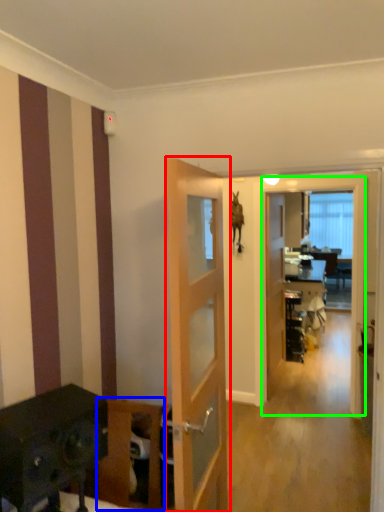
Question: Which object is positioned closest to door (highlighted by a red box)? Select from furniture (highlighted by a blue box) and screen door (highlighted by a green box).

Choices:
 (A) furniture
 (B) screen door

Answer: (A)